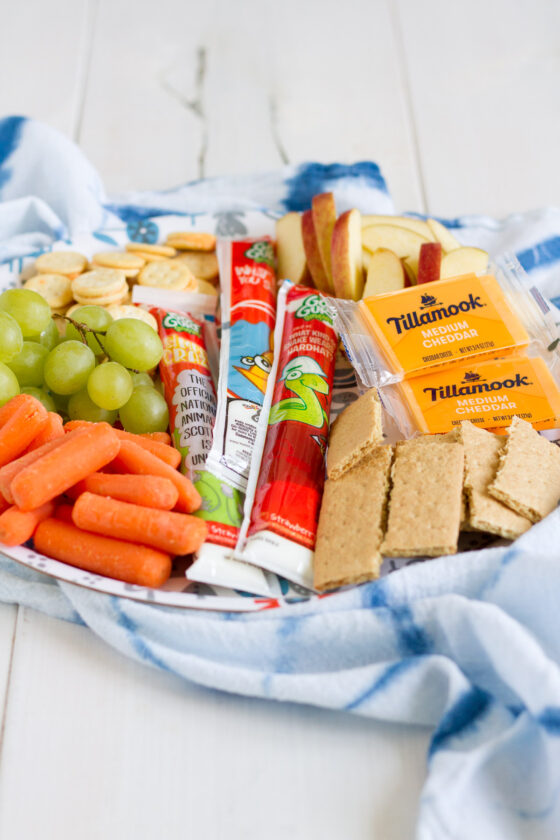
Identify the location of table. This screenshot has width=560, height=840. (276, 42).